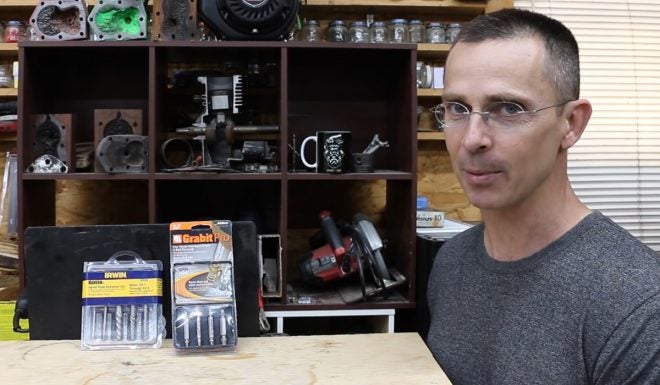
Where is `light purple table top with dark swirls`? light purple table top with dark swirls is located at coordinates (292, 370).